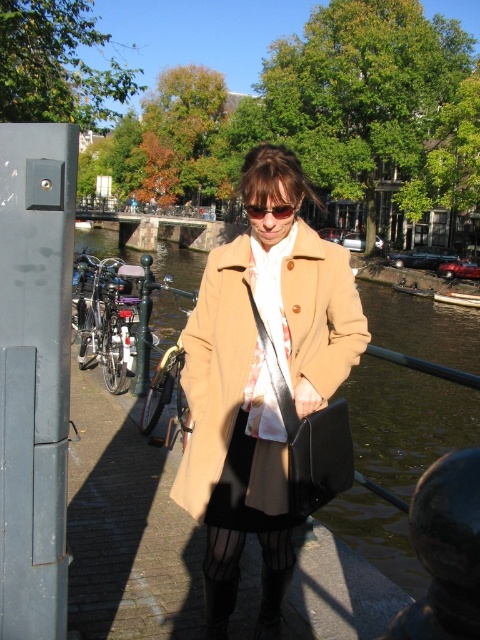
Question: Estimate the real-world distances between objects in this image. Which object is farther from the clear water at center?

Choices:
 (A) clear plastic goggles at center
 (B) beige wool coat at center

Answer: (B)

Question: Does beige wool coat at center appear on the right side of clear plastic goggles at center?

Choices:
 (A) yes
 (B) no

Answer: (A)

Question: Can you confirm if clear water at center is bigger than clear plastic goggles at center?

Choices:
 (A) yes
 (B) no

Answer: (A)

Question: Estimate the real-world distances between objects in this image. Which object is farther from the beige wool coat at center?

Choices:
 (A) clear plastic goggles at center
 (B) clear water at center

Answer: (B)

Question: Does beige wool coat at center appear on the left side of clear plastic goggles at center?

Choices:
 (A) yes
 (B) no

Answer: (B)

Question: Which of the following is the farthest from the observer?

Choices:
 (A) beige wool coat at center
 (B) clear plastic goggles at center
 (C) clear water at center

Answer: (C)